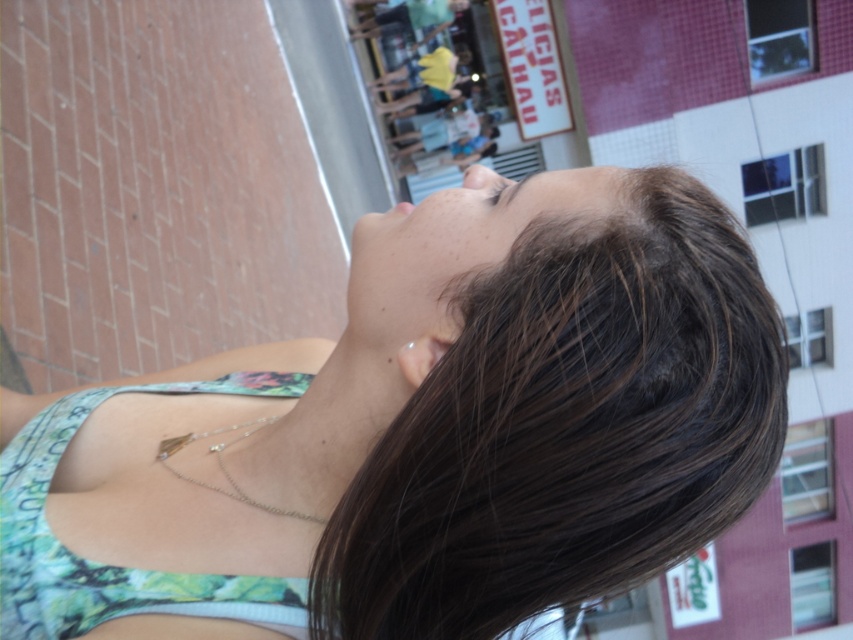
Question: Which point is closer to the camera?

Choices:
 (A) smooth skin face at center
 (B) brown matte eye at upper center
 (C) green floral fabric bikini top at center
 (D) matte skin nose at center

Answer: (A)

Question: Which point appears farthest from the camera in this image?

Choices:
 (A) (402, 371)
 (B) (276, 595)
 (C) (494, 202)

Answer: (C)

Question: Does green floral fabric bikini top at center have a larger size compared to smooth skin face at center?

Choices:
 (A) no
 (B) yes

Answer: (B)

Question: Which of the following is the closest to the observer?

Choices:
 (A) (105, 496)
 (B) (488, 170)
 (C) (438, 248)
 (D) (135, 588)

Answer: (D)

Question: Is matte skin nose at center thinner than brown matte eye at upper center?

Choices:
 (A) yes
 (B) no

Answer: (B)

Question: Does green floral fabric bikini top at center have a greater width compared to smooth skin face at center?

Choices:
 (A) no
 (B) yes

Answer: (B)